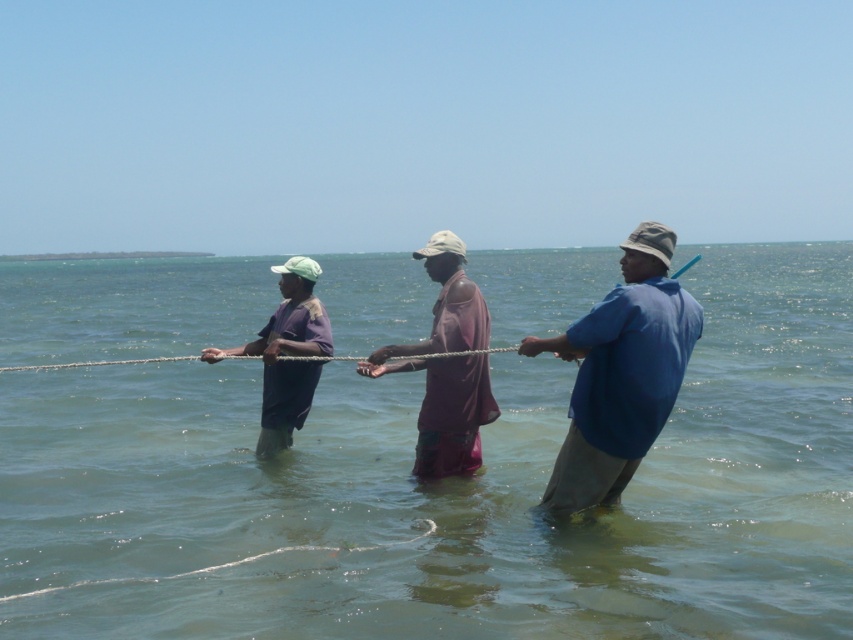
You are standing at the origin of the coordinate system in the image. You see two points, point (296, 534) and point (287, 412). Which point is closer to you?

Point (287, 412) is closer to you because it is behind point (296, 534).

You are standing on the shore and see the clear water at center and the blue cotton shirt at right. Which object is closer to you?

The clear water at center is closer to you because it is in front of the blue cotton shirt at right.

You are a photographer wanting to capture a group photo of the three people in the scene. The photographer is standing at the position of the person wearing the blue cotton shirt at right. The photographer wants to include all three people in the photo without moving any of them. Given that the camera has a maximum zoom range of 10 meters, will the photographer be able to fit all three people into the frame?

The three people are 6.56 meters apart. Since the camera has a maximum zoom range of 10 meters, the photographer can fit all three people into the frame because the distance between them is within the camera range.